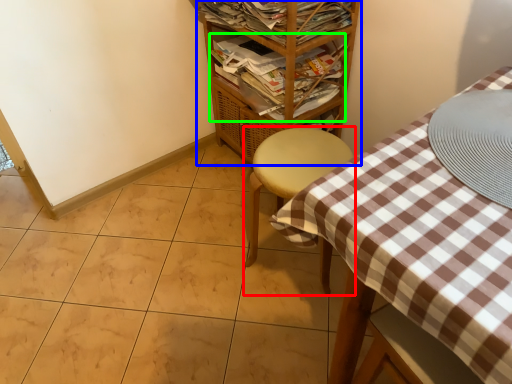
Question: Which object is the closest to the furniture (highlighted by a red box)? Choose among these: shelf (highlighted by a blue box) or magazine (highlighted by a green box).

Choices:
 (A) shelf
 (B) magazine

Answer: (B)